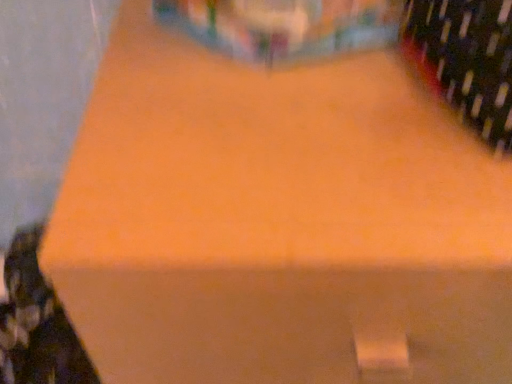
This screenshot has height=384, width=512. Describe the element at coordinates (466, 60) in the screenshot. I see `dark green glass wine bottle at upper right, the 1th wine bottle from the top` at that location.

Locate an element on the screen. Image resolution: width=512 pixels, height=384 pixels. dark green glass wine bottle at upper right, positioned as the 2th wine bottle in back-to-front order is located at coordinates (466, 60).

Image resolution: width=512 pixels, height=384 pixels. What do you see at coordinates (37, 323) in the screenshot? I see `matte black wine bottle at lower left, acting as the 2th wine bottle starting from the right` at bounding box center [37, 323].

This screenshot has height=384, width=512. Identify the location of matte black wine bottle at lower left, acting as the 2th wine bottle starting from the right. (37, 323).

Where is `dark green glass wine bottle at upper right, the 1th wine bottle from the top`? Image resolution: width=512 pixels, height=384 pixels. dark green glass wine bottle at upper right, the 1th wine bottle from the top is located at coordinates (466, 60).

Does matte black wine bottle at lower left, marked as the 2th wine bottle in a top-to-bottom arrangement, appear on the left side of dark green glass wine bottle at upper right, the 1th wine bottle from the top?

Correct, you'll find matte black wine bottle at lower left, marked as the 2th wine bottle in a top-to-bottom arrangement, to the left of dark green glass wine bottle at upper right, the 1th wine bottle from the top.

Between matte black wine bottle at lower left, the first wine bottle positioned from the bottom, and dark green glass wine bottle at upper right, acting as the first wine bottle starting from the right, which one is positioned in front?

dark green glass wine bottle at upper right, acting as the first wine bottle starting from the right, is closer to the camera.

Is point (22, 270) positioned in front of point (452, 0)?

No, (22, 270) is behind (452, 0).

From the image's perspective, is matte black wine bottle at lower left, acting as the 2th wine bottle starting from the right, over dark green glass wine bottle at upper right, acting as the first wine bottle starting from the right?

Actually, matte black wine bottle at lower left, acting as the 2th wine bottle starting from the right, appears below dark green glass wine bottle at upper right, acting as the first wine bottle starting from the right, in the image.

From a real-world perspective, which is physically above, matte black wine bottle at lower left, which appears as the 2th wine bottle when viewed from the front, or dark green glass wine bottle at upper right, positioned as the 2th wine bottle in back-to-front order?

In real-world perspective, dark green glass wine bottle at upper right, positioned as the 2th wine bottle in back-to-front order, is above.

In the scene shown: Is matte black wine bottle at lower left, which appears as the 2th wine bottle when viewed from the front, wider than dark green glass wine bottle at upper right, the 1th wine bottle from the top?

Indeed, matte black wine bottle at lower left, which appears as the 2th wine bottle when viewed from the front, has a greater width compared to dark green glass wine bottle at upper right, the 1th wine bottle from the top.

Based on the photo, considering the sizes of objects matte black wine bottle at lower left, which appears as the 2th wine bottle when viewed from the front, and dark green glass wine bottle at upper right, placed as the first wine bottle when sorted from front to back, in the image provided, who is taller, matte black wine bottle at lower left, which appears as the 2th wine bottle when viewed from the front, or dark green glass wine bottle at upper right, placed as the first wine bottle when sorted from front to back,?

matte black wine bottle at lower left, which appears as the 2th wine bottle when viewed from the front.

Between matte black wine bottle at lower left, marked as the 2th wine bottle in a top-to-bottom arrangement, and dark green glass wine bottle at upper right, positioned as the 2th wine bottle in back-to-front order, which one has smaller size?

dark green glass wine bottle at upper right, positioned as the 2th wine bottle in back-to-front order, is smaller.

Would you say matte black wine bottle at lower left, marked as the 2th wine bottle in a top-to-bottom arrangement, is outside dark green glass wine bottle at upper right, positioned as the 2th wine bottle in back-to-front order?

Yes, matte black wine bottle at lower left, marked as the 2th wine bottle in a top-to-bottom arrangement, is not within dark green glass wine bottle at upper right, positioned as the 2th wine bottle in back-to-front order.

Is matte black wine bottle at lower left, the 1th wine bottle from the left, positioned far away from dark green glass wine bottle at upper right, which appears as the second wine bottle when viewed from the left?

matte black wine bottle at lower left, the 1th wine bottle from the left, is near dark green glass wine bottle at upper right, which appears as the second wine bottle when viewed from the left, not far away.

Is matte black wine bottle at lower left, the first wine bottle positioned from the bottom, oriented away from dark green glass wine bottle at upper right, placed as the first wine bottle when sorted from front to back?

No.

What are the coordinates of `wine bottle on the right of matte black wine bottle at lower left, marked as the 2th wine bottle in a top-to-bottom arrangement` in the screenshot? It's located at (466, 60).

Considering the relative positions of dark green glass wine bottle at upper right, the 2th wine bottle ordered from the bottom, and matte black wine bottle at lower left, acting as the 2th wine bottle starting from the right, in the image provided, is dark green glass wine bottle at upper right, the 2th wine bottle ordered from the bottom, to the right of matte black wine bottle at lower left, acting as the 2th wine bottle starting from the right, from the viewer's perspective?

Yes, dark green glass wine bottle at upper right, the 2th wine bottle ordered from the bottom, is to the right of matte black wine bottle at lower left, acting as the 2th wine bottle starting from the right.

Which object is closer to the camera taking this photo, dark green glass wine bottle at upper right, the 2th wine bottle ordered from the bottom, or matte black wine bottle at lower left, the 1th wine bottle from the left?

dark green glass wine bottle at upper right, the 2th wine bottle ordered from the bottom, is more forward.

Is point (482, 81) closer to viewer compared to point (23, 316)?

Yes, it is in front of point (23, 316).

From the image's perspective, is dark green glass wine bottle at upper right, which appears as the second wine bottle when viewed from the left, beneath matte black wine bottle at lower left, which appears as the 2th wine bottle when viewed from the front?

No.

From a real-world perspective, is dark green glass wine bottle at upper right, positioned as the 2th wine bottle in back-to-front order, located higher than matte black wine bottle at lower left, the 1th wine bottle from the left?

Yes, from a real-world perspective, dark green glass wine bottle at upper right, positioned as the 2th wine bottle in back-to-front order, is over matte black wine bottle at lower left, the 1th wine bottle from the left

Is dark green glass wine bottle at upper right, the 1th wine bottle from the top, wider than matte black wine bottle at lower left, the 1th wine bottle from the left?

No, dark green glass wine bottle at upper right, the 1th wine bottle from the top, is not wider than matte black wine bottle at lower left, the 1th wine bottle from the left.

Which of these two, dark green glass wine bottle at upper right, positioned as the 2th wine bottle in back-to-front order, or matte black wine bottle at lower left, which appears as the 2th wine bottle when viewed from the front, stands taller?

matte black wine bottle at lower left, which appears as the 2th wine bottle when viewed from the front, is taller.

In terms of size, does dark green glass wine bottle at upper right, the 1th wine bottle from the top, appear bigger or smaller than matte black wine bottle at lower left, which is counted as the 1th wine bottle, starting from the back?

In the image, dark green glass wine bottle at upper right, the 1th wine bottle from the top, appears to be smaller than matte black wine bottle at lower left, which is counted as the 1th wine bottle, starting from the back.

Can we say dark green glass wine bottle at upper right, placed as the first wine bottle when sorted from front to back, lies outside matte black wine bottle at lower left, acting as the 2th wine bottle starting from the right?

Yes, dark green glass wine bottle at upper right, placed as the first wine bottle when sorted from front to back, is located beyond the bounds of matte black wine bottle at lower left, acting as the 2th wine bottle starting from the right.

Is the surface of dark green glass wine bottle at upper right, placed as the first wine bottle when sorted from front to back, in direct contact with matte black wine bottle at lower left, marked as the 2th wine bottle in a top-to-bottom arrangement?

dark green glass wine bottle at upper right, placed as the first wine bottle when sorted from front to back, and matte black wine bottle at lower left, marked as the 2th wine bottle in a top-to-bottom arrangement, are clearly separated.

Is dark green glass wine bottle at upper right, acting as the first wine bottle starting from the right, aimed at matte black wine bottle at lower left, acting as the 2th wine bottle starting from the right?

No, dark green glass wine bottle at upper right, acting as the first wine bottle starting from the right, is not oriented towards matte black wine bottle at lower left, acting as the 2th wine bottle starting from the right.

What's the angular difference between dark green glass wine bottle at upper right, which appears as the second wine bottle when viewed from the left, and matte black wine bottle at lower left, marked as the 2th wine bottle in a top-to-bottom arrangement,'s facing directions?

The facing directions of dark green glass wine bottle at upper right, which appears as the second wine bottle when viewed from the left, and matte black wine bottle at lower left, marked as the 2th wine bottle in a top-to-bottom arrangement, are 4.29 degrees apart.

The width and height of the screenshot is (512, 384). I want to click on wine bottle located above the matte black wine bottle at lower left, which appears as the 2th wine bottle when viewed from the front (from a real-world perspective), so [466, 60].

The width and height of the screenshot is (512, 384). I want to click on wine bottle on the left of dark green glass wine bottle at upper right, positioned as the 2th wine bottle in back-to-front order, so click(37, 323).

Where is `wine bottle above the matte black wine bottle at lower left, which is counted as the 1th wine bottle, starting from the back (from a real-world perspective)`? The image size is (512, 384). wine bottle above the matte black wine bottle at lower left, which is counted as the 1th wine bottle, starting from the back (from a real-world perspective) is located at coordinates (466, 60).